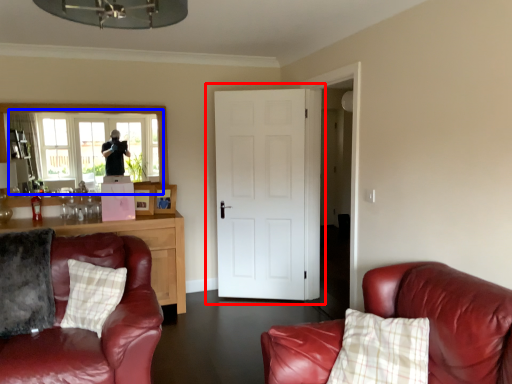
Question: Among these objects, which one is nearest to the camera, door (highlighted by a red box) or window (highlighted by a blue box)?

Choices:
 (A) door
 (B) window

Answer: (B)